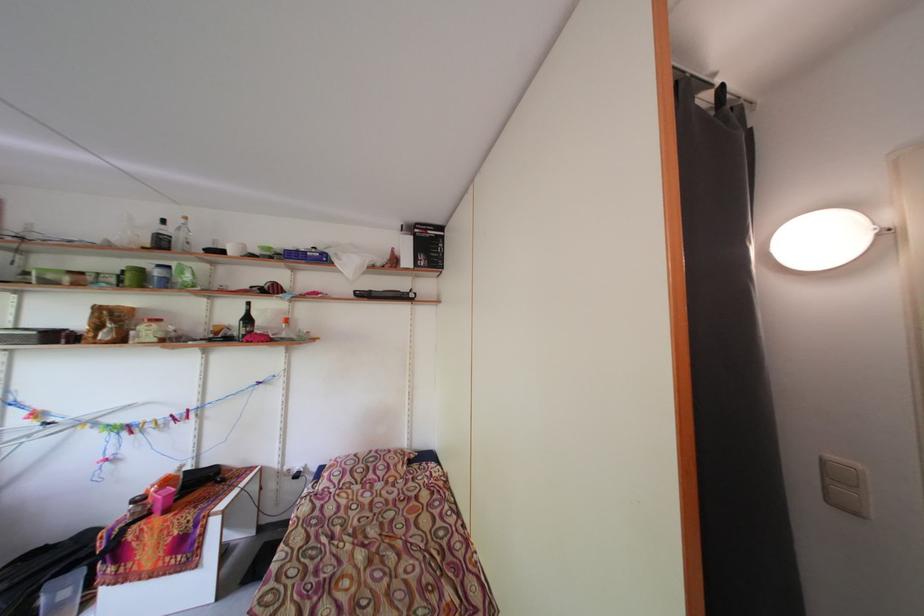
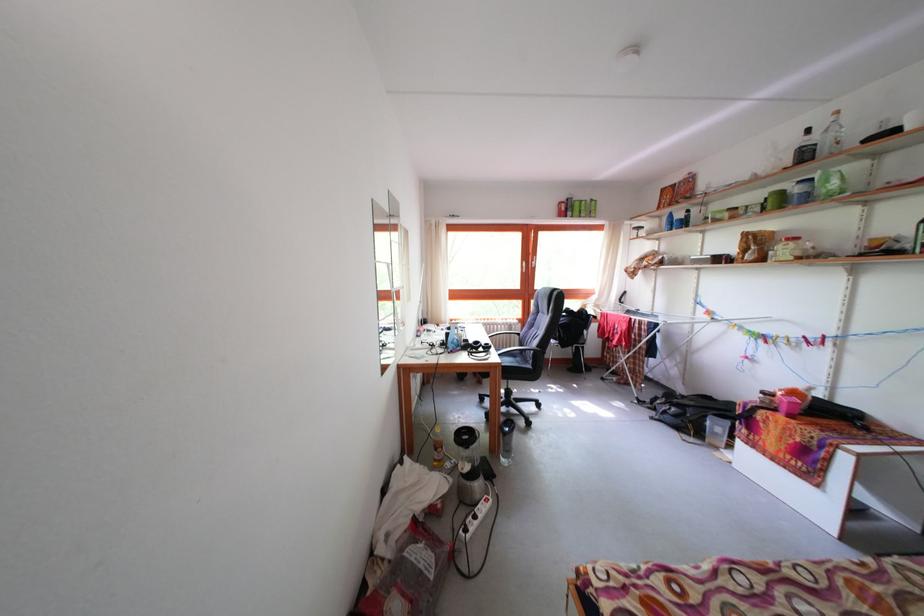
The point at [141,315] is marked in the first image. Where is the corresponding point in the second image?

(783, 238)